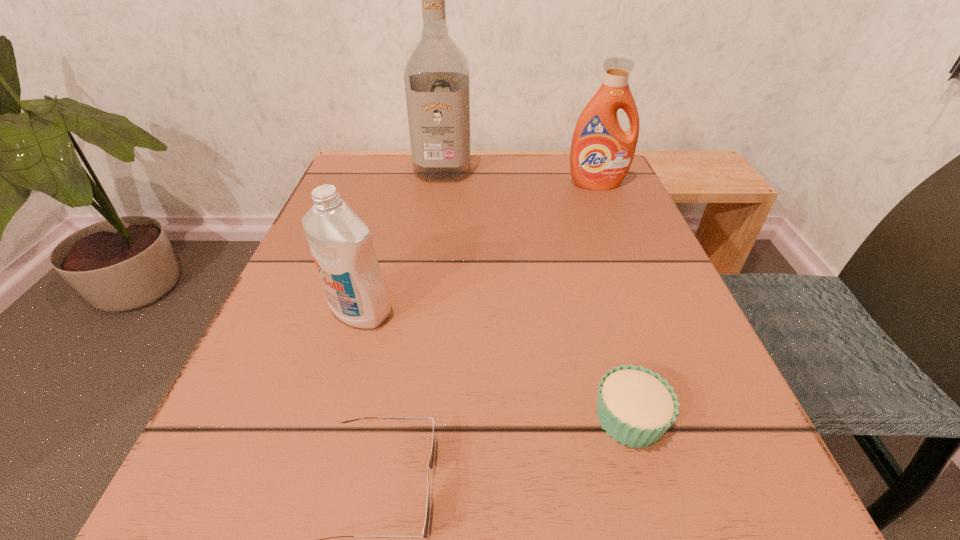
Identify the location of liquor that is positioned at the far edge. (437, 86).

The image size is (960, 540). What are the coordinates of `detergent that is at the far edge` in the screenshot? It's located at (601, 154).

The width and height of the screenshot is (960, 540). What are the coordinates of `object located at the left edge` in the screenshot? It's located at (340, 242).

The width and height of the screenshot is (960, 540). Identify the location of detergent that is at the right edge. (601, 154).

Find the location of a particular element. cupcake present at the right edge is located at coordinates (635, 406).

The width and height of the screenshot is (960, 540). Identify the location of object located at the far right corner. (601, 154).

Locate an element on the screen. This screenshot has width=960, height=540. free space at the far edge of the desktop is located at coordinates [x=513, y=164].

Locate an element on the screen. The height and width of the screenshot is (540, 960). blank area at the left edge is located at coordinates (376, 249).

Identify the location of vacant region at the right edge of the desktop. (635, 250).

The image size is (960, 540). What are the coordinates of `free space that is in between the second tallest object and the liquor` in the screenshot? It's located at pyautogui.click(x=519, y=177).